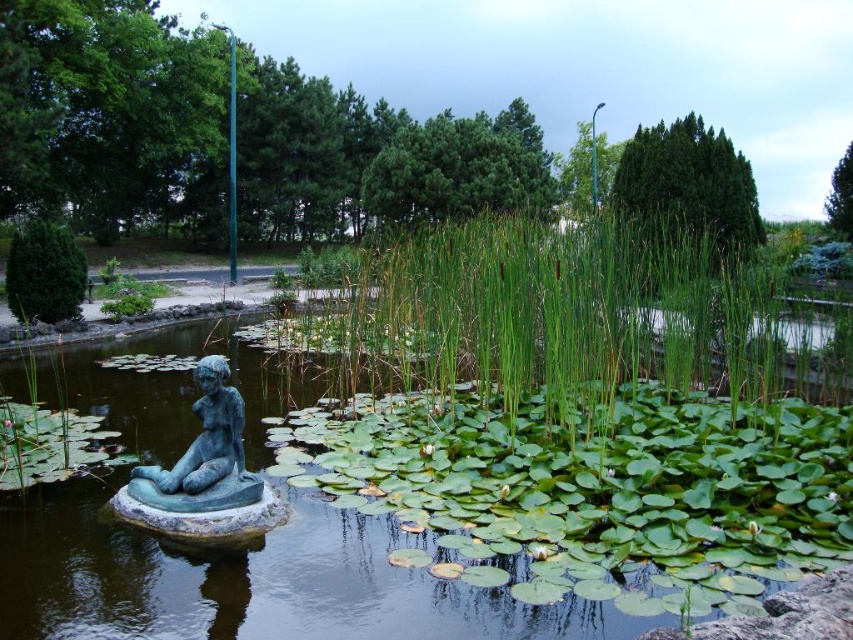
Is green patina statue at left positioned before green grassy reed at center?

Yes, it is in front of green grassy reed at center.

Which is more to the left, green patina statue at left or green grassy reed at center?

From the viewer's perspective, green patina statue at left appears more on the left side.

Is point (485, 621) less distant than point (469, 236)?

Yes.

This screenshot has width=853, height=640. Identify the location of green patina statue at left. (254, 580).

Is green grassy reed at center thinner than green patina statue at lower left?

No, green grassy reed at center is not thinner than green patina statue at lower left.

Which is in front, point (682, 304) or point (202, 500)?

Positioned in front is point (202, 500).

Does point (496, 307) come farther from viewer compared to point (222, 445)?

Yes, it is.

Where is `green grassy reed at center`? Image resolution: width=853 pixels, height=640 pixels. green grassy reed at center is located at coordinates (558, 310).

Does point (573, 614) lie in front of point (235, 456)?

Yes, it is.

Does green patina statue at left have a smaller size compared to green patina statue at lower left?

No.

Does point (93, 522) come farther from viewer compared to point (180, 456)?

No, it is in front of (180, 456).

Identify the location of green patina statue at left. (254, 580).